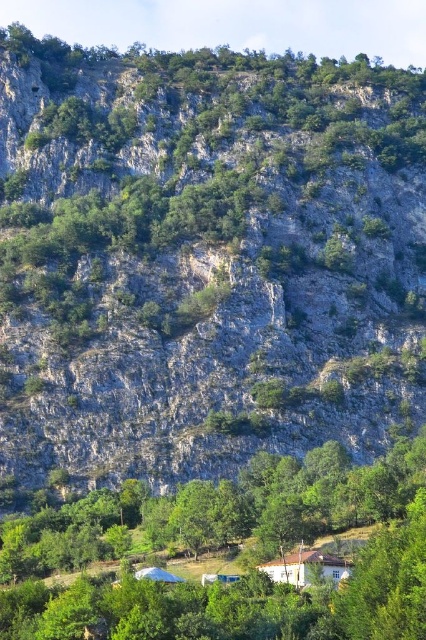
Question: Which point is closer to the camera?

Choices:
 (A) green leafy tree at center
 (B) white wooden house at lower center

Answer: (A)

Question: Among these points, which one is farthest from the camera?

Choices:
 (A) (299, 576)
 (B) (114, 525)

Answer: (B)

Question: Does green leafy tree at center lie in front of white wooden house at lower center?

Choices:
 (A) yes
 (B) no

Answer: (A)

Question: Is green leafy tree at center behind white wooden house at lower center?

Choices:
 (A) yes
 (B) no

Answer: (B)

Question: Can you confirm if green leafy tree at center is bigger than white wooden house at lower center?

Choices:
 (A) yes
 (B) no

Answer: (A)

Question: Among these points, which one is nearest to the camera?

Choices:
 (A) (298, 557)
 (B) (233, 588)

Answer: (B)